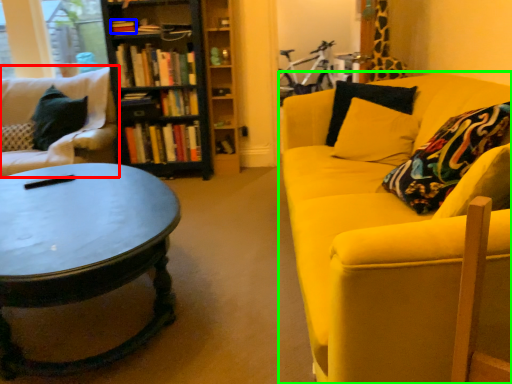
Question: Which object is positioned closest to studio couch (highlighted by a red box)? Select from book (highlighted by a blue box) and studio couch (highlighted by a green box).

Choices:
 (A) book
 (B) studio couch

Answer: (A)